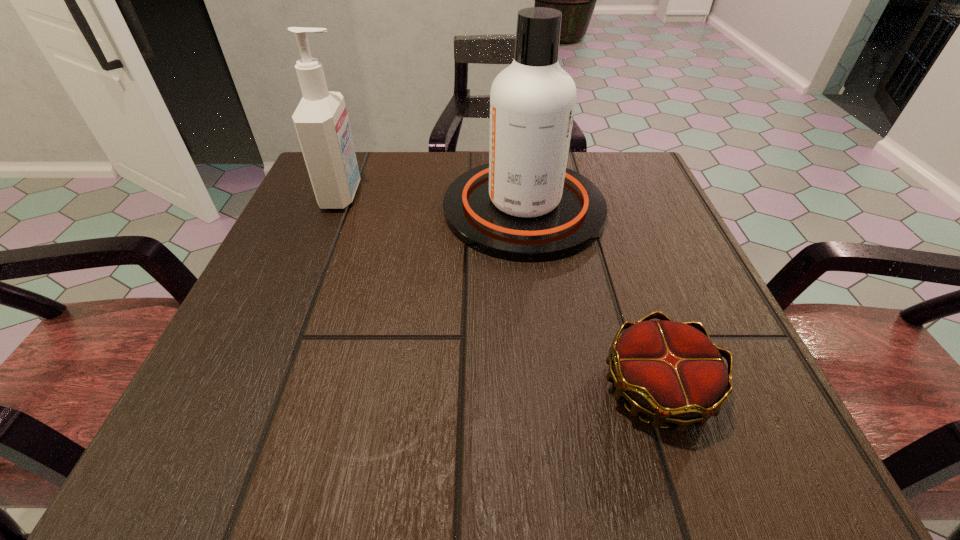
The width and height of the screenshot is (960, 540). I want to click on the right cleansing agent, so click(x=524, y=205).

Where is `the leftmost object`? This screenshot has height=540, width=960. the leftmost object is located at coordinates (321, 122).

Find the location of a particular element. The width and height of the screenshot is (960, 540). crown is located at coordinates (671, 371).

The width and height of the screenshot is (960, 540). Identify the location of the nearest object. (671, 371).

This screenshot has width=960, height=540. What are the coordinates of `vacant space situated 0.080m on the front of the right cleansing agent` in the screenshot? It's located at (535, 296).

This screenshot has height=540, width=960. Identify the location of vacant region located on the front label of the leftmost object. (386, 194).

Where is `free space located on the back of the crown`? Image resolution: width=960 pixels, height=540 pixels. free space located on the back of the crown is located at coordinates (598, 208).

What are the coordinates of `object that is at the near edge` in the screenshot? It's located at (671, 371).

I want to click on object situated at the left edge, so click(321, 122).

The width and height of the screenshot is (960, 540). Identify the location of cleansing agent that is at the right edge. (524, 205).